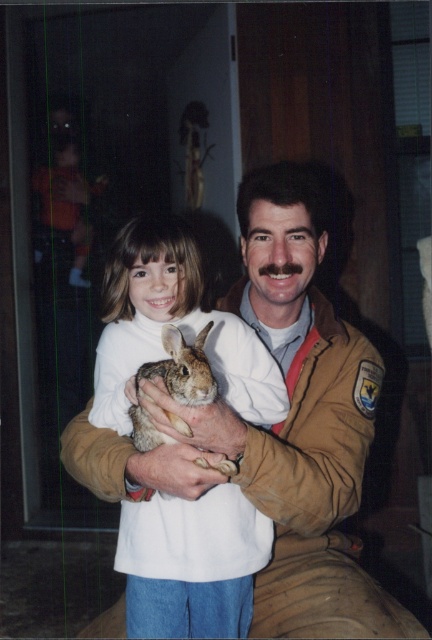
Question: Does white soft turtleneck at center lie behind fuzzy brown rabbit at center?

Choices:
 (A) no
 (B) yes

Answer: (B)

Question: Does white soft turtleneck at center come behind fuzzy brown rabbit at center?

Choices:
 (A) yes
 (B) no

Answer: (A)

Question: Among these objects, which one is nearest to the camera?

Choices:
 (A) white soft turtleneck at center
 (B) fuzzy brown rabbit at center

Answer: (B)

Question: Which point appears farthest from the camera in this image?

Choices:
 (A) (200, 332)
 (B) (222, 509)

Answer: (B)

Question: Can you confirm if white soft turtleneck at center is smaller than fuzzy brown rabbit at center?

Choices:
 (A) no
 (B) yes

Answer: (A)